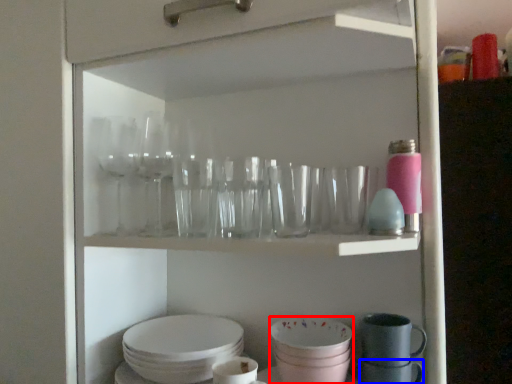
Question: Which object is closer to the camera taking this photo, tableware (highlighted by a red box) or tableware (highlighted by a blue box)?

Choices:
 (A) tableware
 (B) tableware

Answer: (A)